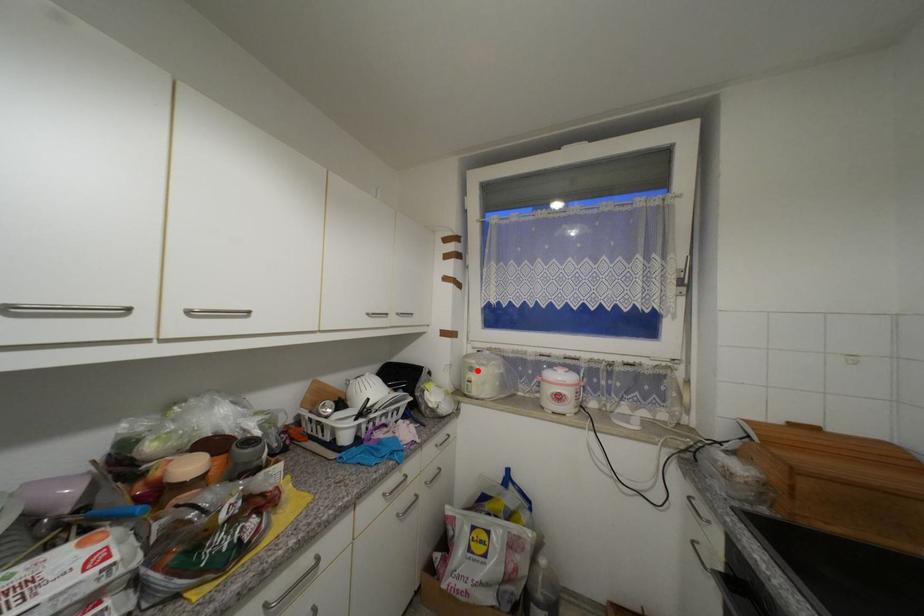
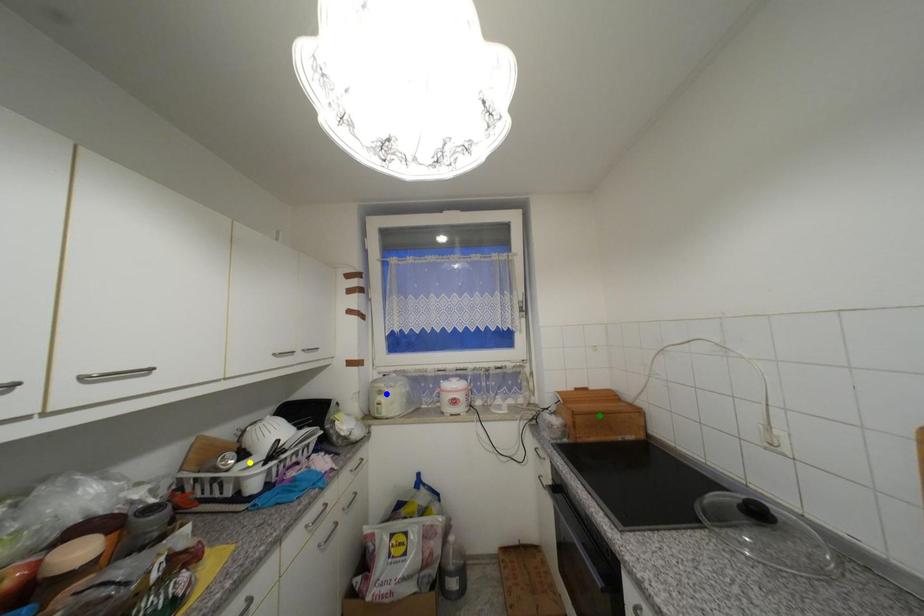
Question: I am providing you with two images of the same scene from different viewpoints. A red point is marked on the first image. You are given multiple points on the second image. Which point in image 2 represents the same 3d spot as the red point in image 1?

Choices:
 (A) yellow point
 (B) green point
 (C) blue point

Answer: (C)